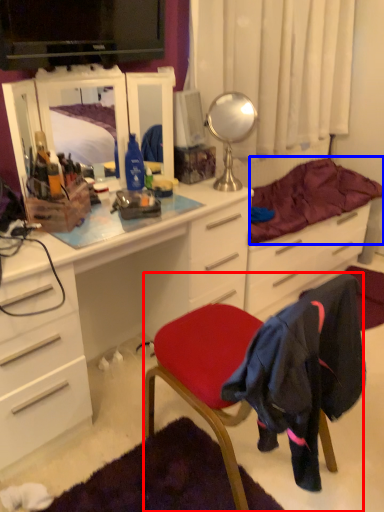
Question: Among these objects, which one is farthest to the camera, chair (highlighted by a red box) or bedding (highlighted by a blue box)?

Choices:
 (A) chair
 (B) bedding

Answer: (B)